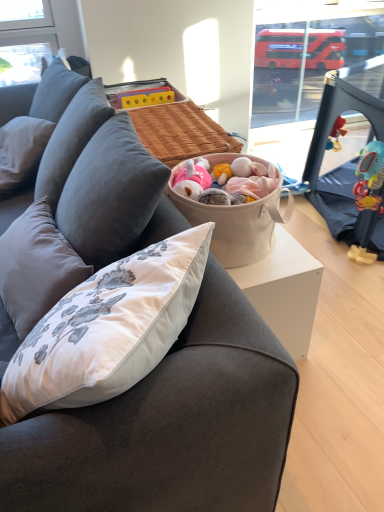
The width and height of the screenshot is (384, 512). What do you see at coordinates (304, 67) in the screenshot?
I see `transparent plastic window screen at upper right` at bounding box center [304, 67].

Measure the distance between point (197, 216) and camera.

They are 1.15 meters apart.

I want to click on transparent plastic window screen at upper right, so click(304, 67).

Would you say gray fabric pillow at left is outside transparent plastic window screen at upper right?

Yes, gray fabric pillow at left is located beyond the bounds of transparent plastic window screen at upper right.

Locate an element on the screen. pillow that is above the transparent plastic window screen at upper right (from a real-world perspective) is located at coordinates (22, 150).

Who is taller, gray fabric pillow at left or transparent plastic window screen at upper right?

Standing taller between the two is transparent plastic window screen at upper right.

Identify the location of picnic basket below the transparent plastic window screen at upper right (from the image's perspective). (233, 225).

Is transparent plastic window screen at upper right to the right of beige fabric basket at center from the viewer's perspective?

Yes.

Who is bigger, transparent plastic window screen at upper right or beige fabric basket at center?

transparent plastic window screen at upper right.

From the picture: Which object is thinner, transparent plastic window screen at upper right or beige fabric basket at center?

beige fabric basket at center is thinner.

Considering the sizes of objects gray fabric pillow at left and beige fabric basket at center in the image provided, who is taller, gray fabric pillow at left or beige fabric basket at center?

beige fabric basket at center.

Are gray fabric pillow at left and beige fabric basket at center located far from each other?

No, gray fabric pillow at left is not far from beige fabric basket at center.

Where is `pillow that is on the left side of beige fabric basket at center`? Image resolution: width=384 pixels, height=512 pixels. pillow that is on the left side of beige fabric basket at center is located at coordinates (22, 150).

Which is more to the right, transparent plastic window screen at upper right or gray fabric pillow at left?

transparent plastic window screen at upper right.

This screenshot has width=384, height=512. What are the coordinates of `window screen on the right of gray fabric pillow at left` in the screenshot? It's located at (304, 67).

Is transparent plastic window screen at upper right with gray fabric pillow at left?

No.

From the picture: How distant is transparent plastic window screen at upper right from gray fabric pillow at left?

A distance of 2.01 meters exists between transparent plastic window screen at upper right and gray fabric pillow at left.

From the picture: Is dark gray fabric couch at center next to beige fabric basket at center?

They are not placed beside each other.

Is dark gray fabric couch at center shorter than beige fabric basket at center?

Incorrect, the height of dark gray fabric couch at center does not fall short of that of beige fabric basket at center.

What are the coordinates of `studio couch on the left of beige fabric basket at center` in the screenshot? It's located at (172, 425).

How different are the orientations of gray fabric pillow at left and dark gray fabric couch at center in degrees?

20.5 degrees.

Does gray fabric pillow at left appear on the right side of dark gray fabric couch at center?

Incorrect, gray fabric pillow at left is not on the right side of dark gray fabric couch at center.

Is point (12, 189) farther from viewer compared to point (274, 449)?

Yes, point (12, 189) is behind point (274, 449).

Is gray fabric pillow at left facing away from dark gray fabric couch at center?

Yes.

Locate an element on the screen. This screenshot has width=384, height=512. studio couch on the left of the transparent plastic window screen at upper right is located at coordinates (172, 425).

Which object is positioned more to the left, dark gray fabric couch at center or transparent plastic window screen at upper right?

From the viewer's perspective, dark gray fabric couch at center appears more on the left side.

Which is correct: dark gray fabric couch at center is inside transparent plastic window screen at upper right, or outside of it?

The correct answer is: outside.

Can you confirm if dark gray fabric couch at center is thinner than transparent plastic window screen at upper right?

Yes.

This screenshot has height=512, width=384. I want to click on window screen below the gray fabric pillow at left (from a real-world perspective), so click(x=304, y=67).

The width and height of the screenshot is (384, 512). In order to click on window screen that is above the beige fabric basket at center (from the image's perspective) in this screenshot , I will do `click(304, 67)`.

In the scene shown: Based on their spatial positions, is gray fabric pillow at left or transparent plastic window screen at upper right closer to beige fabric basket at center?

The object closer to beige fabric basket at center is gray fabric pillow at left.

Looking at the image, which one is located closer to gray fabric pillow at left, transparent plastic window screen at upper right or dark gray fabric couch at center?

dark gray fabric couch at center is positioned closer to the anchor gray fabric pillow at left.

Considering their positions, is dark gray fabric couch at center positioned further to transparent plastic window screen at upper right than gray fabric pillow at left?

Among the two, dark gray fabric couch at center is located further to transparent plastic window screen at upper right.

Based on their spatial positions, is beige fabric basket at center or gray fabric pillow at left further from dark gray fabric couch at center?

Among the two, gray fabric pillow at left is located further to dark gray fabric couch at center.

Based on their spatial positions, is beige fabric basket at center or transparent plastic window screen at upper right further from gray fabric pillow at left?

transparent plastic window screen at upper right lies further to gray fabric pillow at left than the other object.

Looking at the image, which one is located closer to transparent plastic window screen at upper right, beige fabric basket at center or dark gray fabric couch at center?

beige fabric basket at center is positioned closer to the anchor transparent plastic window screen at upper right.

Estimate the real-world distances between objects in this image. Which object is further from transparent plastic window screen at upper right, beige fabric basket at center or gray fabric pillow at left?

gray fabric pillow at left is positioned further to the anchor transparent plastic window screen at upper right.

Considering their positions, is dark gray fabric couch at center positioned further to beige fabric basket at center than transparent plastic window screen at upper right?

transparent plastic window screen at upper right is positioned further to the anchor beige fabric basket at center.

Identify the location of studio couch between gray fabric pillow at left and transparent plastic window screen at upper right from left to right. (172, 425).

You are a GUI agent. You are given a task and a screenshot of the screen. Output one action in this format:
    pyautogui.click(x=<x>, y=<y>)
    Task: Click on the picnic basket located between gray fabric pillow at left and transparent plastic window screen at upper right in the left-right direction
    The image size is (384, 512).
    Given the screenshot: What is the action you would take?
    pyautogui.click(x=233, y=225)

Identify the location of picnic basket positioned between dark gray fabric couch at center and gray fabric pillow at left from near to far. The height and width of the screenshot is (512, 384). (233, 225).

Image resolution: width=384 pixels, height=512 pixels. I want to click on picnic basket between dark gray fabric couch at center and transparent plastic window screen at upper right in the horizontal direction, so click(x=233, y=225).